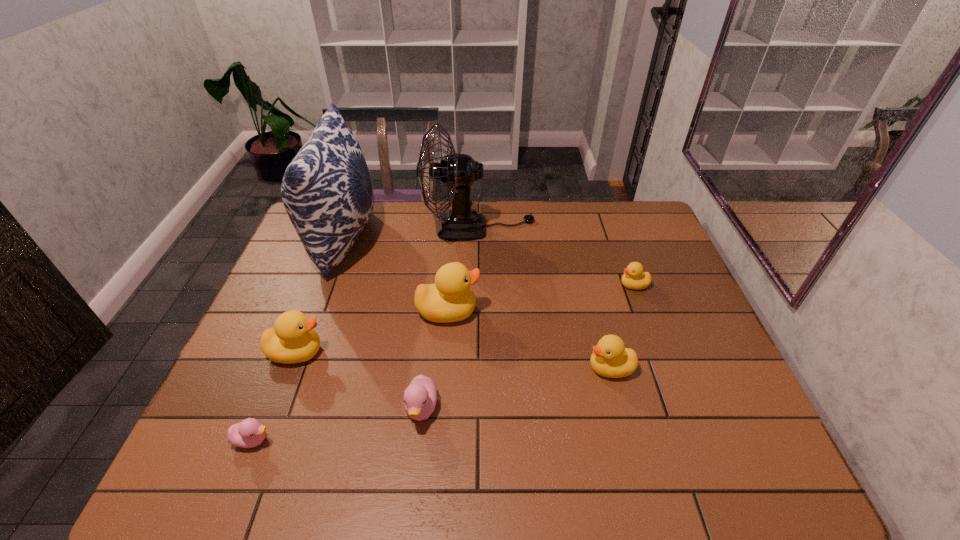
Select which yellow duckling is the second closest to the third nearest yellow duckling. Please provide its 2D coordinates. Your answer should be formatted as a tuple, i.e. [(x, y)], where the tuple contains the x and y coordinates of a point satisfying the conditions above.

[(610, 358)]

Identify the location of yellow duckling that stands as the fourth closest to the smaller pink duckling. The width and height of the screenshot is (960, 540). (634, 278).

Where is `vacant space that satisfies the following two spatial constraints: 1. on the face of the rightmost duckling; 2. on the front-facing side of the bigger pink duckling`? Image resolution: width=960 pixels, height=540 pixels. vacant space that satisfies the following two spatial constraints: 1. on the face of the rightmost duckling; 2. on the front-facing side of the bigger pink duckling is located at coordinates (679, 409).

Where is `free location that satisfies the following two spatial constraints: 1. in front of the black fan, indicating the direction of air flow; 2. on the front-facing side of the bigger pink duckling`? free location that satisfies the following two spatial constraints: 1. in front of the black fan, indicating the direction of air flow; 2. on the front-facing side of the bigger pink duckling is located at coordinates (479, 409).

In order to click on vacant space that satisfies the following two spatial constraints: 1. on the front-facing side of the right pink duckling; 2. on the front-facing side of the left pink duckling in this screenshot , I will do `click(419, 440)`.